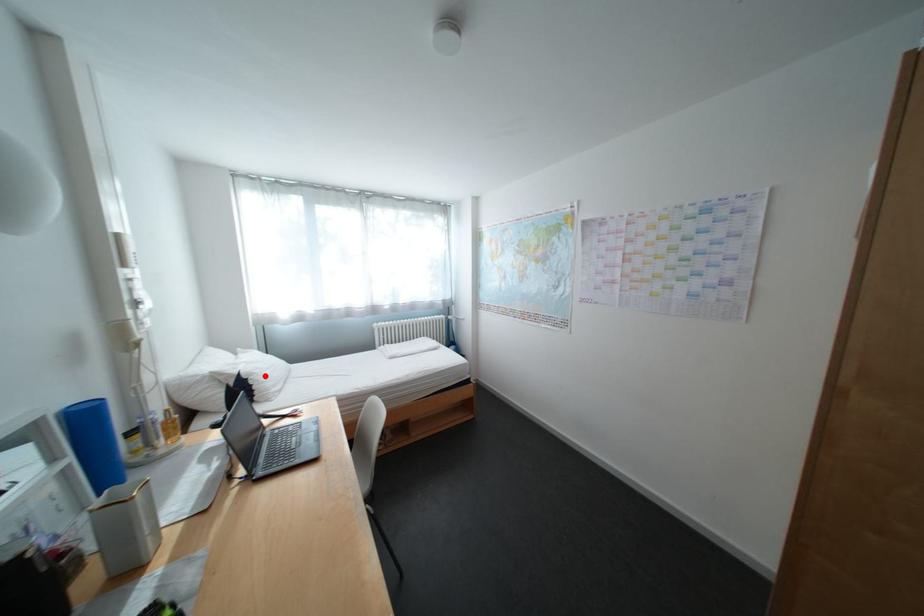
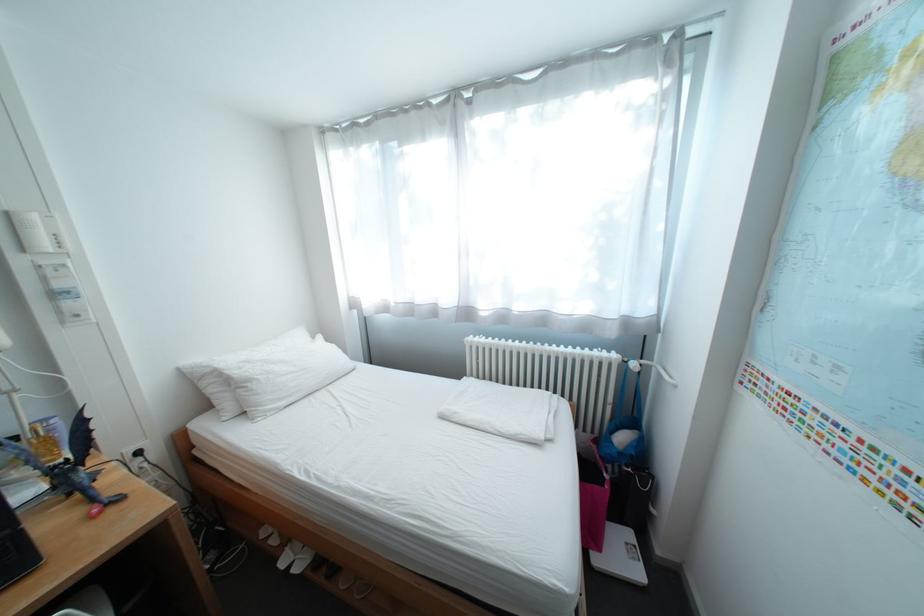
In the second image, find the point that corresponds to the highlighted location in the first image.

(263, 383)